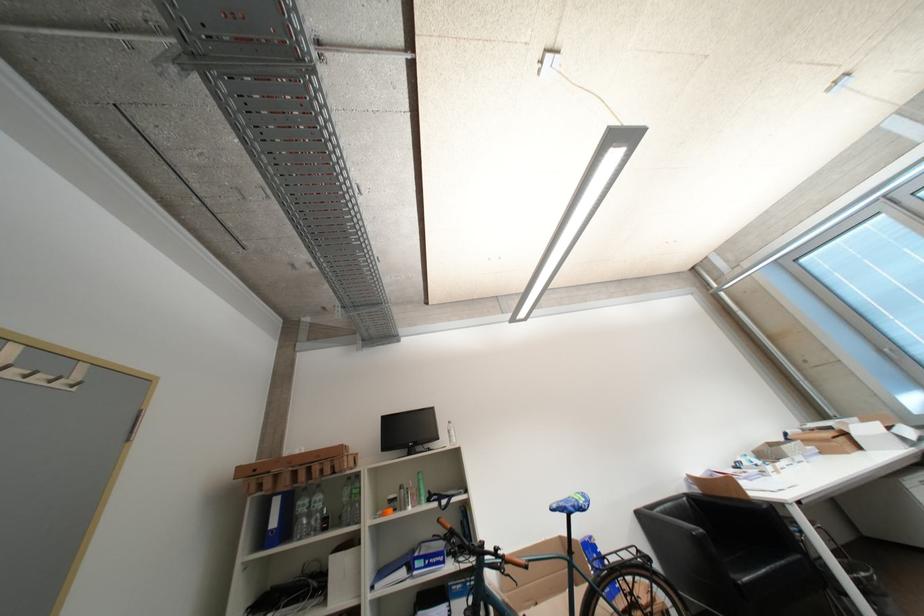
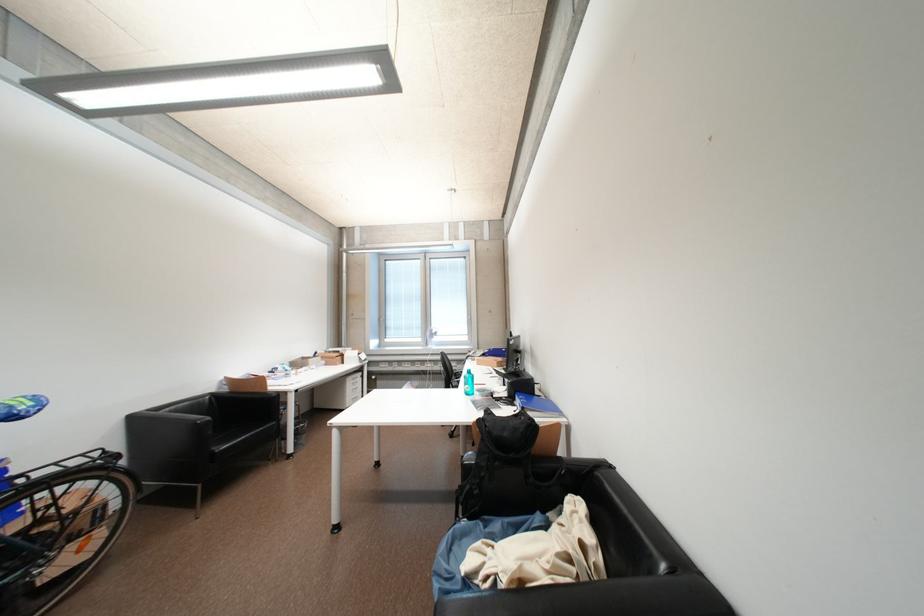
Find the pixel in the second image that matches point (704, 492) in the first image.

(234, 391)